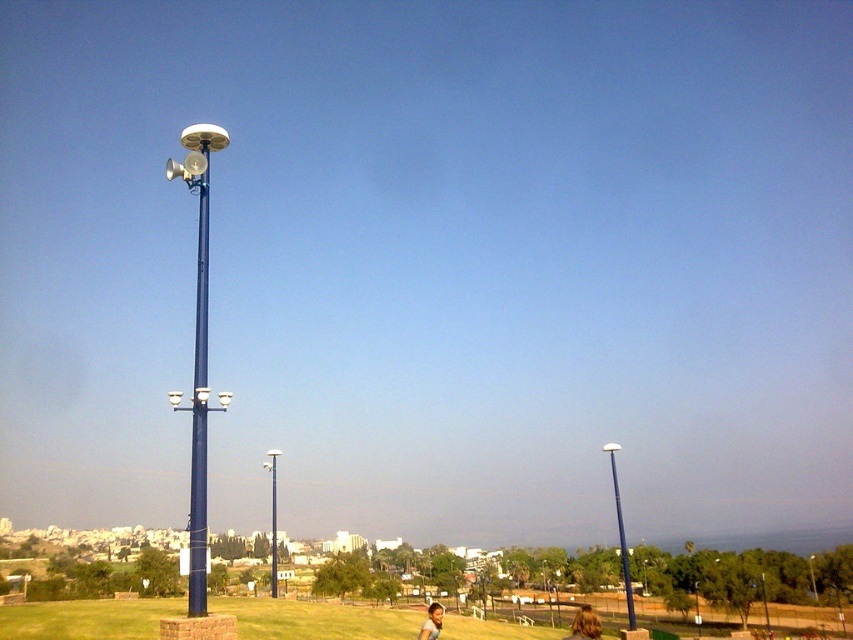
You are a city planner assessing the placement of poles in a public area. You have two poles, the metallic blue pole at center and the metallic silver pole at right. Based on their sizes, which pole would be more suitable for mounting additional fixtures like cameras or emergency buttons?

The metallic blue pole at center is larger in size than the metallic silver pole at right, making it more suitable for mounting additional fixtures like cameras or emergency buttons.

You are standing at the point marked by the coordinates point (271, 516) in the image. Looking around, you see the metallic blue pole at center. What is the direction of the nearest building in the background relative to your position?

The nearest building in the background is located behind the metallic blue pole at center relative to your position.